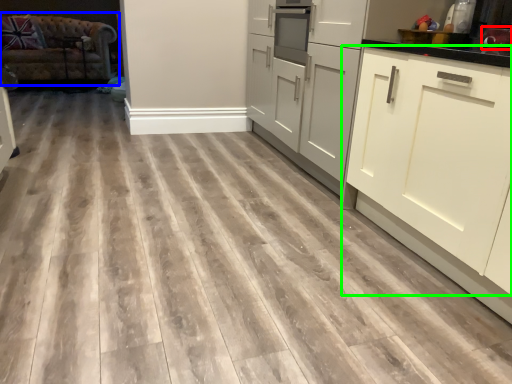
Question: Based on their relative distances, which object is nearer to appliance (highlighted by a red box)? Choose from studio couch (highlighted by a blue box) and cabinetry (highlighted by a green box).

Choices:
 (A) studio couch
 (B) cabinetry

Answer: (B)